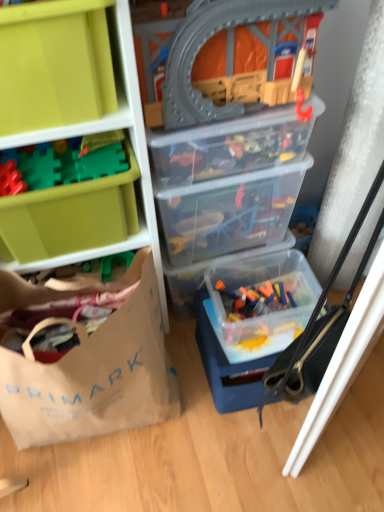
The height and width of the screenshot is (512, 384). I want to click on vacant area located to the right-hand side of brown paper bag at lower left, so point(208,435).